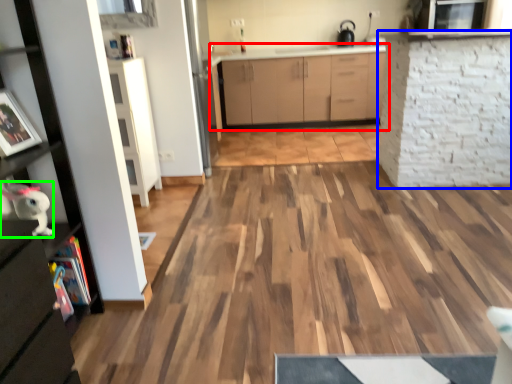
Question: Which is farther away from cabinetry (highlighted by a red box)? shelf (highlighted by a blue box) or toy (highlighted by a green box)?

Choices:
 (A) shelf
 (B) toy

Answer: (B)